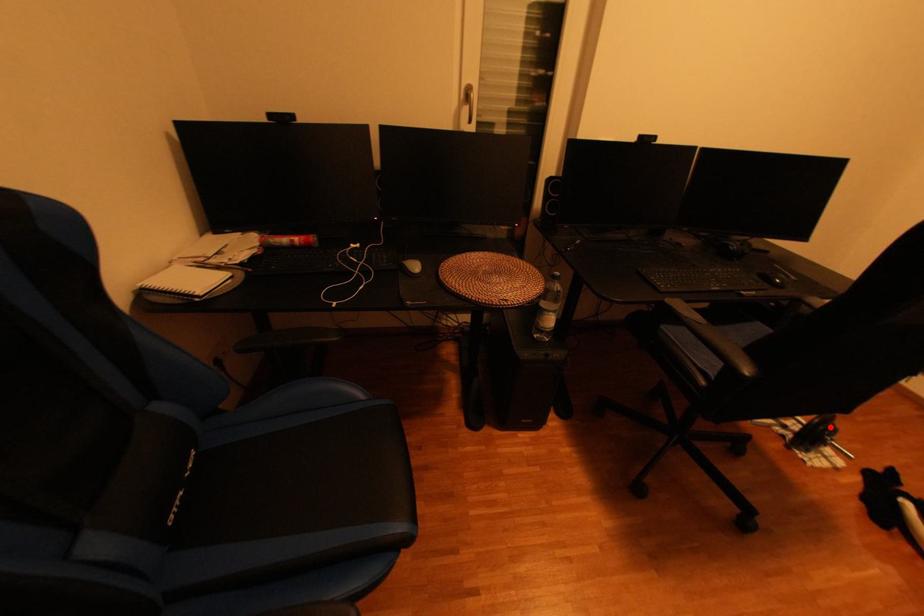
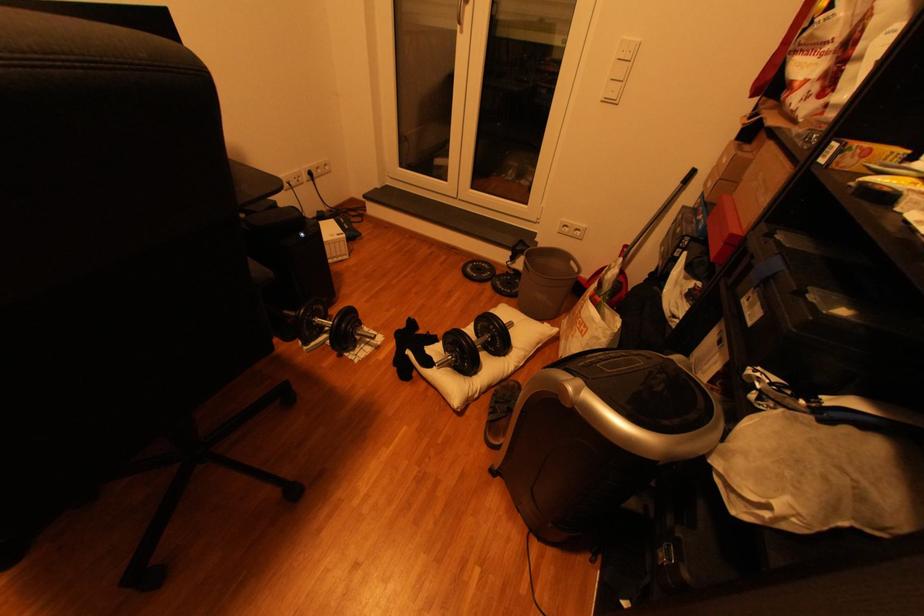
Where in the second image is the point corresponding to the highlighted location from the first image?

(354, 326)